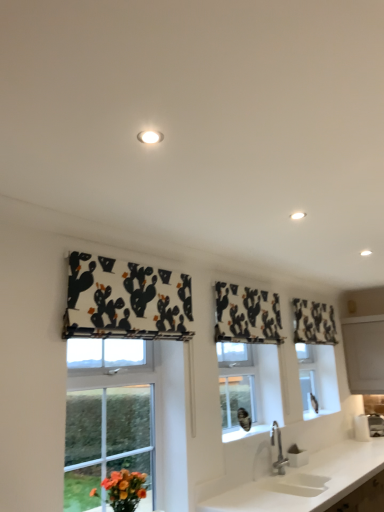
Question: Is black printed fabric at upper center, arranged as the 3th curtain when viewed from the front, inside the boundaries of white matte countertop at lower center, or outside?

Choices:
 (A) inside
 (B) outside

Answer: (B)

Question: Considering the positions of black printed fabric at upper center, the 1th curtain positioned from the right, and white matte countertop at lower center in the image, is black printed fabric at upper center, the 1th curtain positioned from the right, taller or shorter than white matte countertop at lower center?

Choices:
 (A) short
 (B) tall

Answer: (A)

Question: Which is farther from the white fabric with black cactus print at left, acting as the 1th curtain starting from the left?

Choices:
 (A) black printed fabric at upper center, acting as the 1th curtain starting from the back
 (B) black printed fabric at center, arranged as the second curtain when viewed from the left
 (C) white matte countertop at lower center
 (D) white glossy light fixture at upper center

Answer: (A)

Question: Based on their relative distances, which object is nearer to the black printed fabric at center, positioned as the 2th curtain in right-to-left order?

Choices:
 (A) white fabric with black cactus print at left, the third curtain when ordered from back to front
 (B) black printed fabric at upper center, acting as the 1th curtain starting from the back
 (C) white glossy light fixture at upper center
 (D) white matte countertop at lower center

Answer: (B)